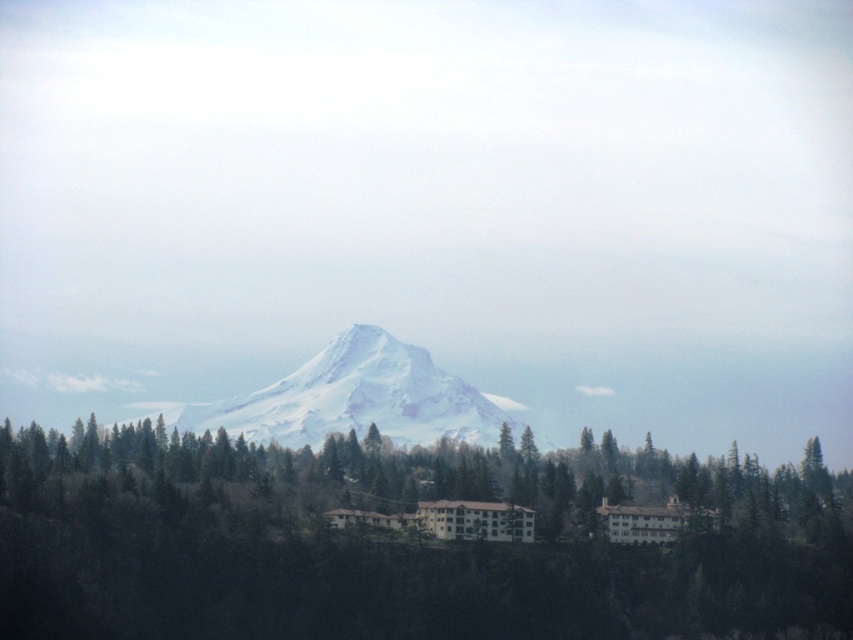
You are standing at the base of the mountain and want to take a photo of both points shown in the scene. Which point, point (x=589, y=500) or point (x=366, y=332), is closer to you?

Point (x=589, y=500) is closer to you because it is in front of point (x=366, y=332).